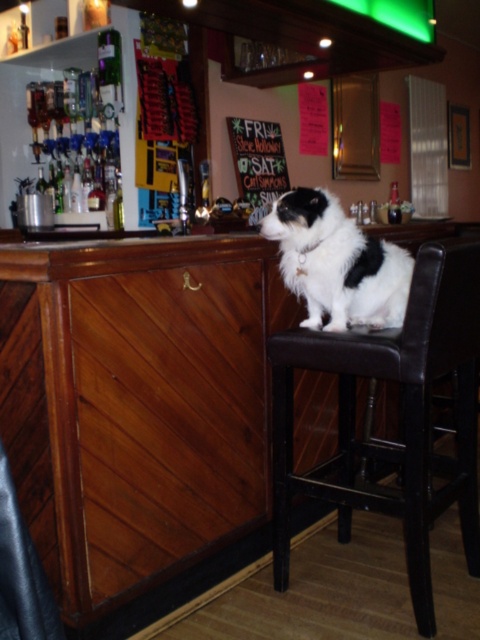
Question: Which object is closer to the camera taking this photo?

Choices:
 (A) black and white fur at center
 (B) wooden signboard at center

Answer: (A)

Question: Does black and white fur at center have a larger size compared to wooden signboard at center?

Choices:
 (A) no
 (B) yes

Answer: (A)

Question: Can you confirm if brown leather chair at center is bigger than black and white fur at center?

Choices:
 (A) no
 (B) yes

Answer: (B)

Question: Is the position of black and white fur at center more distant than that of wooden signboard at center?

Choices:
 (A) yes
 (B) no

Answer: (B)

Question: Which point appears farthest from the camera in this image?

Choices:
 (A) (269, 348)
 (B) (252, 173)

Answer: (B)

Question: Which point is closer to the camera?

Choices:
 (A) (243, 179)
 (B) (416, 346)
 (C) (297, 214)

Answer: (B)